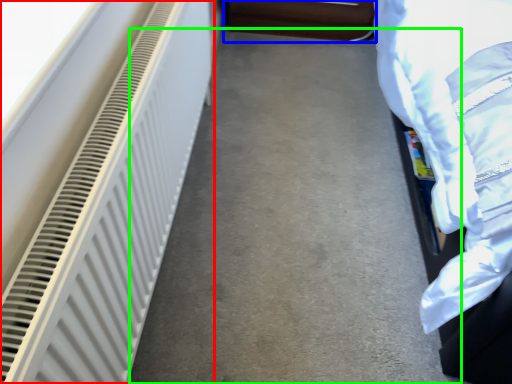
Question: Based on their relative distances, which object is nearer to radiator (highlighted by a red box)? Choose from furniture (highlighted by a blue box) and concrete (highlighted by a green box).

Choices:
 (A) furniture
 (B) concrete

Answer: (B)